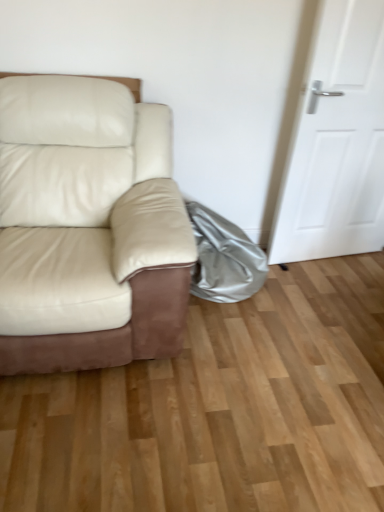
Question: Would you consider shiny metallic bag at lower right to be distant from white matte door at right?

Choices:
 (A) yes
 (B) no

Answer: (B)

Question: Considering the relative positions of shiny metallic bag at lower right and white matte door at right in the image provided, is shiny metallic bag at lower right to the right of white matte door at right from the viewer's perspective?

Choices:
 (A) no
 (B) yes

Answer: (A)

Question: Does shiny metallic bag at lower right appear on the left side of white matte door at right?

Choices:
 (A) no
 (B) yes

Answer: (B)

Question: Is shiny metallic bag at lower right positioned with its back to white matte door at right?

Choices:
 (A) yes
 (B) no

Answer: (B)

Question: From a real-world perspective, is shiny metallic bag at lower right positioned over white matte door at right based on gravity?

Choices:
 (A) no
 (B) yes

Answer: (A)

Question: Is shiny metallic bag at lower right next to white matte door at right?

Choices:
 (A) no
 (B) yes

Answer: (A)

Question: Considering the relative positions of white matte door at right and matte cream leather couch at left in the image provided, is white matte door at right to the left of matte cream leather couch at left from the viewer's perspective?

Choices:
 (A) no
 (B) yes

Answer: (A)

Question: Is white matte door at right not within matte cream leather couch at left?

Choices:
 (A) yes
 (B) no

Answer: (A)

Question: Considering the relative positions of white matte door at right and matte cream leather couch at left in the image provided, is white matte door at right in front of matte cream leather couch at left?

Choices:
 (A) no
 (B) yes

Answer: (A)

Question: Could you tell me if white matte door at right is facing matte cream leather couch at left?

Choices:
 (A) yes
 (B) no

Answer: (B)

Question: Can you confirm if white matte door at right is wider than matte cream leather couch at left?

Choices:
 (A) yes
 (B) no

Answer: (B)

Question: From the image's perspective, is white matte door at right located above matte cream leather couch at left?

Choices:
 (A) no
 (B) yes

Answer: (B)

Question: From the image's perspective, is matte cream leather couch at left under shiny metallic bag at lower right?

Choices:
 (A) no
 (B) yes

Answer: (A)